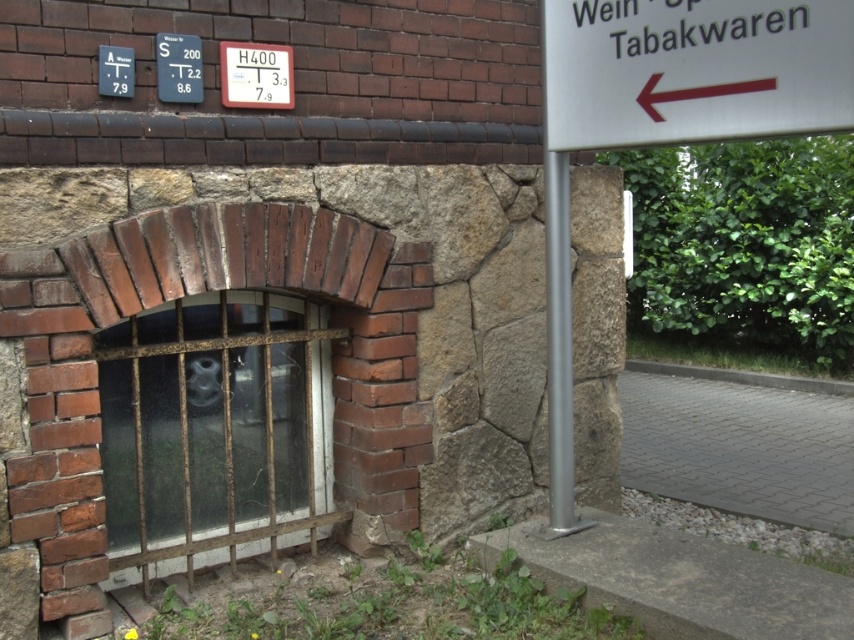
Which is more to the right, rusty metal bars at center or white plastic sign at upper left?

rusty metal bars at center

Is point (215, 540) less distant than point (115, 65)?

No, it is not.

I want to click on rusty metal bars at center, so click(x=215, y=428).

Based on the photo, can you confirm if white plastic sign at upper center is positioned above white plastic sign at upper left?

Correct, white plastic sign at upper center is located above white plastic sign at upper left.

Where is `white plastic sign at upper center`? white plastic sign at upper center is located at coordinates (256, 76).

Locate an element on the screen. The width and height of the screenshot is (854, 640). white plastic sign at upper center is located at coordinates (256, 76).

Who is lower down, rusty metal bars at center or white plastic sign at upper center?

Positioned lower is rusty metal bars at center.

Is rusty metal bars at center shorter than white plastic sign at upper center?

Incorrect, rusty metal bars at center's height does not fall short of white plastic sign at upper center's.

Between point (200, 460) and point (241, 60), which one is positioned in front?

Point (241, 60) is more forward.

Identify the location of rusty metal bars at center. The width and height of the screenshot is (854, 640). (215, 428).